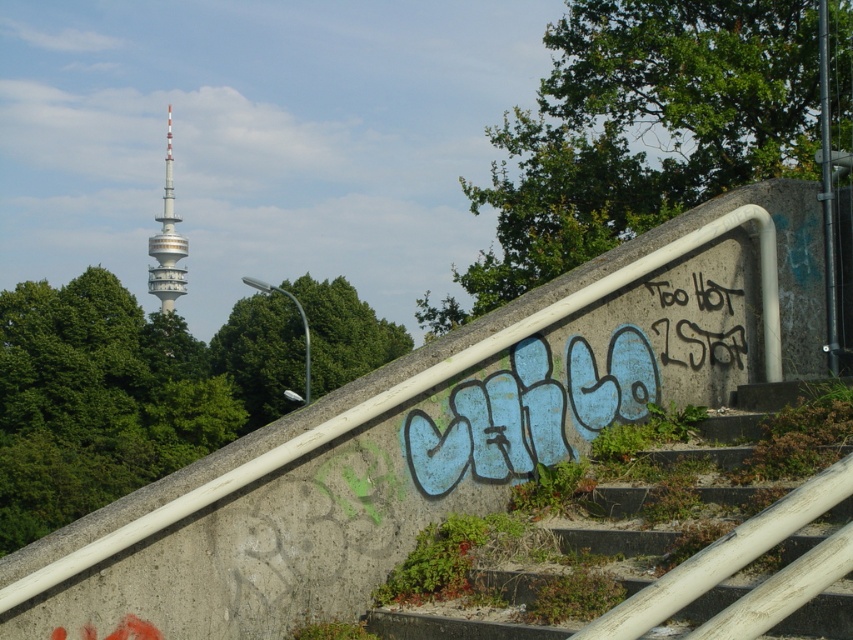
Does concrete stairs at center have a greater height compared to white concrete tower at upper left?

No.

Does concrete stairs at center have a greater width compared to white concrete tower at upper left?

Incorrect, concrete stairs at center's width does not surpass white concrete tower at upper left's.

Find the location of a particular element. concrete stairs at center is located at coordinates (618, 524).

I want to click on concrete stairs at center, so click(618, 524).

Is concrete stairs at center bigger than black graffiti at upper right?

Indeed, concrete stairs at center has a larger size compared to black graffiti at upper right.

At what (x,y) coordinates should I click in order to perform the action: click on concrete stairs at center. Please return your answer as a coordinate pair (x, y). The width and height of the screenshot is (853, 640). Looking at the image, I should click on (618, 524).

Can you confirm if black graffiti at upper right is positioned above white concrete tower at upper left?

Actually, black graffiti at upper right is below white concrete tower at upper left.

Between point (727, 291) and point (173, 243), which one is positioned behind?

The point (173, 243) is more distant.

This screenshot has height=640, width=853. I want to click on black graffiti at upper right, so click(701, 342).